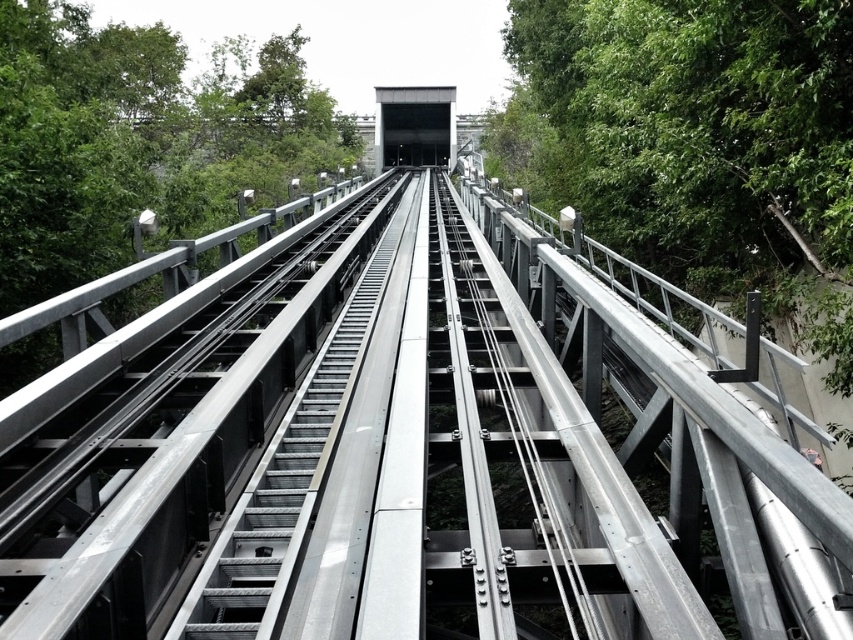
From the picture: You are a maintenance worker assigned to inspect both the green leafy tree at right and the metallic silver escalator at center. Based on their sizes, which object would require more time to inspect? Please explain your reasoning.

The green leafy tree at right is larger in size than the metallic silver escalator at center, so it would require more time to inspect.